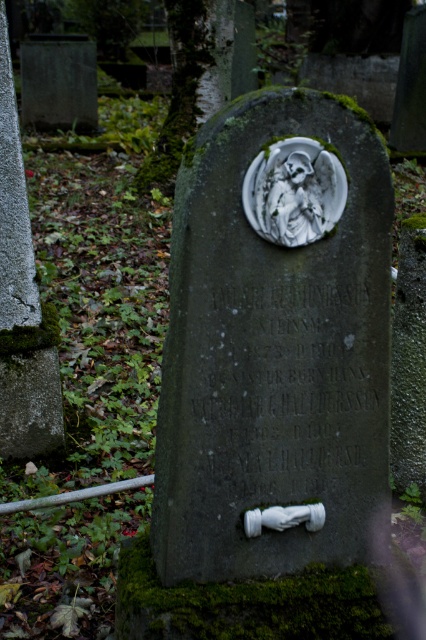
Question: Does green mossy stone at center appear on the left side of white stone angel at center?

Choices:
 (A) yes
 (B) no

Answer: (A)

Question: Which of the following is the farthest from the observer?

Choices:
 (A) green mossy stone at center
 (B) white stone angel at center

Answer: (B)

Question: Which object is closer to the camera taking this photo?

Choices:
 (A) green mossy stone at center
 (B) white stone angel at center

Answer: (A)

Question: Observing the image, what is the correct spatial positioning of green mossy stone at center in reference to white stone angel at center?

Choices:
 (A) right
 (B) left

Answer: (B)

Question: Among these points, which one is nearest to the camera?

Choices:
 (A) (294, 170)
 (B) (373, 188)

Answer: (A)

Question: Is green mossy stone at center above white stone angel at center?

Choices:
 (A) no
 (B) yes

Answer: (A)